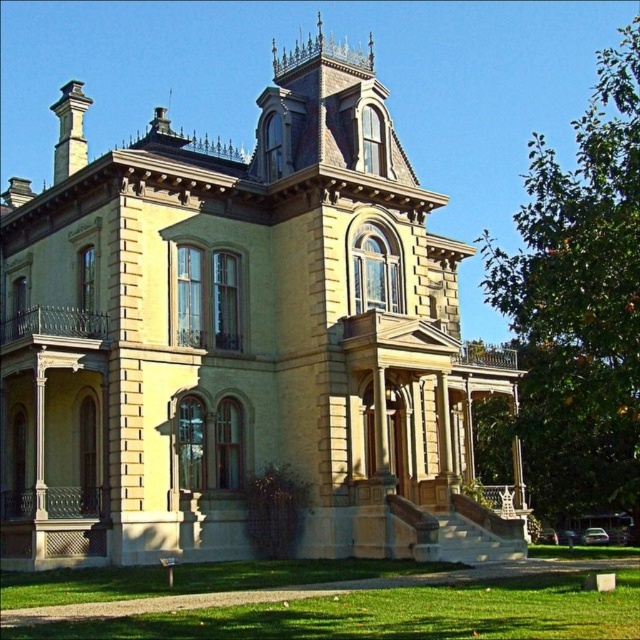
You are standing in a park and see the yellow stone mansion at center and the green grass at lower center. Which object is located to the right of the other?

The green grass at lower center is located to the right of the yellow stone mansion at center.

You are standing on the green grass at lower center looking up at the yellow stone mansion at center. Which direction should you face to see the mansion?

You should face upward because the yellow stone mansion at center is above green grass at lower center.